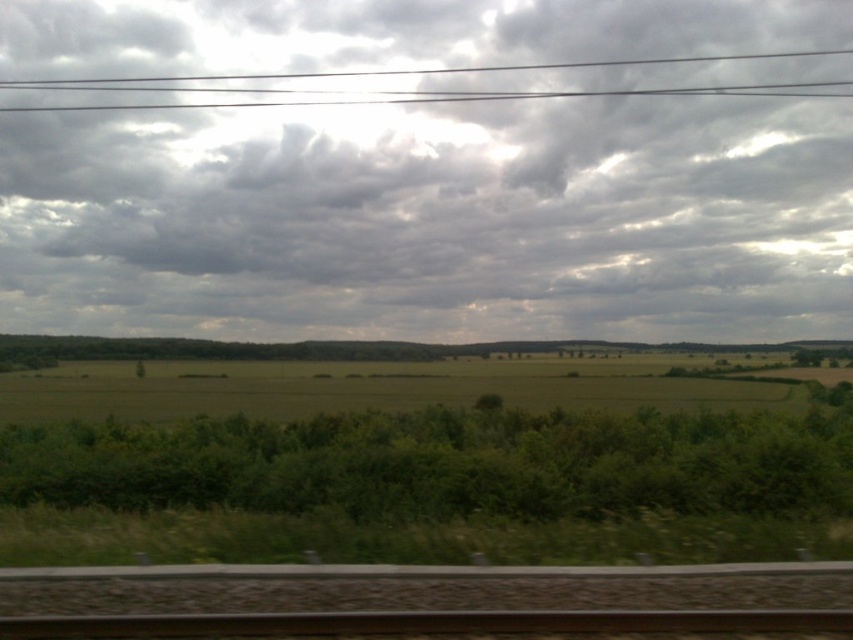
You are a photographer planning to capture the rural landscape described. You want to ensure that both the brown metallic train track at bottom and the black wires at upper center are visible in your photo. Based on their spatial relationship, which object will occupy a smaller portion of the frame?

The brown metallic train track at bottom occupies less space than the black wires at upper center, so it will take up a smaller portion of the frame.

You are a photographer planning to take a picture of the brown metallic train track at bottom and the black wires at upper center. Which object is positioned to the right side of the other?

The brown metallic train track at bottom is to the right of black wires at upper center.